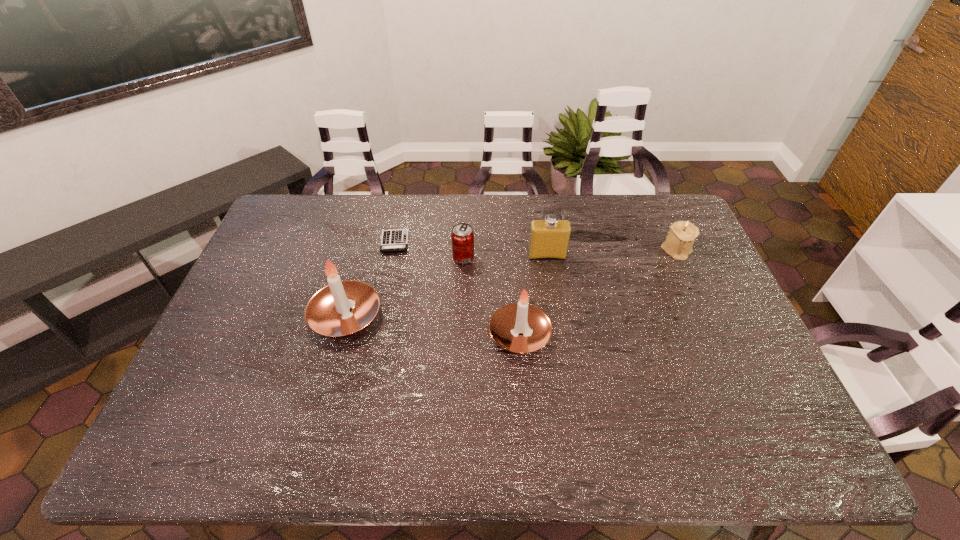
Image resolution: width=960 pixels, height=540 pixels. I want to click on free space between the tallest object and the right candle, so point(433,325).

What are the coordinates of `free space that is in between the calculator and the right candle` in the screenshot? It's located at (457, 288).

Where is `vacant area between the taller candle and the perfume`? Image resolution: width=960 pixels, height=540 pixels. vacant area between the taller candle and the perfume is located at coordinates (446, 286).

This screenshot has width=960, height=540. What are the coordinates of `free spot between the taller candle and the candle_holder` in the screenshot? It's located at click(x=511, y=283).

This screenshot has width=960, height=540. In order to click on free area in between the perfume and the rightmost object in this screenshot , I will do `click(612, 253)`.

Find the location of a particular element. empty location between the pop soda and the calculator is located at coordinates (429, 250).

The height and width of the screenshot is (540, 960). What are the coordinates of `free space between the right candle and the left candle` in the screenshot? It's located at (433, 325).

Locate an element on the screen. The height and width of the screenshot is (540, 960). vacant area that lies between the right candle and the fourth object from right to left is located at coordinates (492, 296).

The image size is (960, 540). What are the coordinates of `free spot between the left candle and the candle_holder` in the screenshot? It's located at (511, 283).

Where is `the fourth closest object to the shortest object`? the fourth closest object to the shortest object is located at coordinates (549, 238).